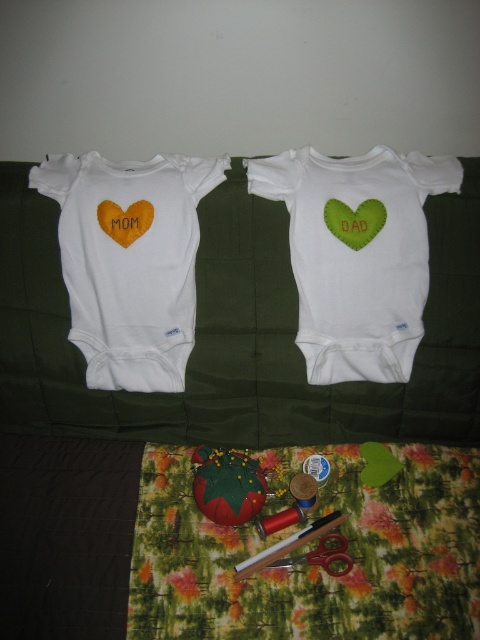
Question: In this image, where is green felt heart at center located relative to metallic silver scissors at lower center?

Choices:
 (A) right
 (B) left

Answer: (A)

Question: Based on their relative distances, which object is farther from the green felt heart at center?

Choices:
 (A) white felt heart at center
 (B) metallic silver scissors at lower center
 (C) matte orange heart at upper left

Answer: (B)

Question: Which of the following is the closest to the observer?

Choices:
 (A) (90, 348)
 (B) (276, 564)
 (C) (316, 276)

Answer: (B)

Question: Among these points, which one is farthest from the camera?

Choices:
 (A) (115, 220)
 (B) (336, 573)

Answer: (A)

Question: Is white felt heart at center positioned at the back of matte white onesie at left?

Choices:
 (A) no
 (B) yes

Answer: (A)

Question: Does white felt heart at center have a lesser width compared to matte white onesie at left?

Choices:
 (A) no
 (B) yes

Answer: (A)